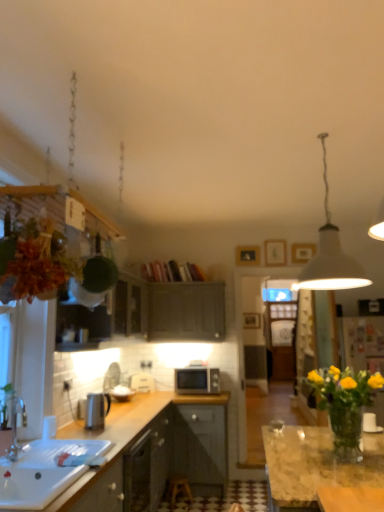
I want to click on white matte pendant lamp at upper right, so click(x=331, y=255).

This screenshot has width=384, height=512. Describe the element at coordinates (35, 261) in the screenshot. I see `leather-like brown plant hanger at upper left` at that location.

At what (x,y) coordinates should I click in order to perform the action: click on leather-like brown plant hanger at upper left. Please return your answer as a coordinate pair (x, y). This screenshot has width=384, height=512. Looking at the image, I should click on (35, 261).

Identify the location of brushed metal faucet at left. (16, 428).

Describe the element at coordinates (97, 410) in the screenshot. This screenshot has width=384, height=512. I see `metallic silver kettle at left` at that location.

The height and width of the screenshot is (512, 384). What do you see at coordinates (142, 382) in the screenshot? I see `white matte microwave at center` at bounding box center [142, 382].

In order to face white matte microwave at center, should I rotate leftwards or rightwards?

Turn left approximately 6.537 degrees to face it.

The width and height of the screenshot is (384, 512). Find the location of `green matte cabinet at upper left, the 2th cabinetry when ordered from right to left`. green matte cabinet at upper left, the 2th cabinetry when ordered from right to left is located at coordinates point(152,312).

Who is shorter, metallic silver kettle at left or wooden stool at center?

wooden stool at center.

Could you tell me if metallic silver kettle at left is facing wooden stool at center?

No, metallic silver kettle at left is not oriented towards wooden stool at center.

Is metallic silver kettle at left positioned in front of wooden stool at center?

Yes.

Looking at this image, is metallic silver kettle at left wider or thinner than wooden stool at center?

Clearly, metallic silver kettle at left has less width compared to wooden stool at center.

Is wooden stool at center facing towards white matte microwave at center?

No, wooden stool at center does not turn towards white matte microwave at center.

From a real-world perspective, is wooden stool at center above or below white matte microwave at center?

Clearly, from a real-world perspective, wooden stool at center is below white matte microwave at center.

Consider the image. Is wooden stool at center placed right next to white matte microwave at center?

wooden stool at center and white matte microwave at center are clearly separated.

Does point (175, 504) come closer to viewer compared to point (133, 375)?

Yes, it is in front of point (133, 375).

Is leather-like brown plant hanger at upper left positioned with its back to green matte cabinet at upper left, which is the second cabinetry in back-to-front order?

No, green matte cabinet at upper left, which is the second cabinetry in back-to-front order, is not at the back of leather-like brown plant hanger at upper left.

Between leather-like brown plant hanger at upper left and green matte cabinet at upper left, the 2th cabinetry when ordered from right to left, which one has less height?

leather-like brown plant hanger at upper left.

Is leather-like brown plant hanger at upper left not within green matte cabinet at upper left, which is the second cabinetry in back-to-front order?

That's correct, leather-like brown plant hanger at upper left is outside of green matte cabinet at upper left, which is the second cabinetry in back-to-front order.

From the image's perspective, which cabinetry is the 1st one below the leather-like brown plant hanger at upper left? Please provide its 2D coordinates.

[(152, 312)]

From a real-world perspective, who is located higher, metallic silver kettle at left or matte gray cabinet at center, the second cabinetry in the left-to-right sequence?

matte gray cabinet at center, the second cabinetry in the left-to-right sequence, is physically above.

Is there a large distance between metallic silver kettle at left and matte gray cabinet at center, positioned as the first cabinetry in right-to-left order?

Yes.

Could you tell me if metallic silver kettle at left is facing matte gray cabinet at center, positioned as the first cabinetry in right-to-left order?

No, metallic silver kettle at left is not facing towards matte gray cabinet at center, positioned as the first cabinetry in right-to-left order.

In the image, is metallic silver kettle at left on the left side or the right side of matte gray cabinet at center, which is the 1th cabinetry from back to front?

metallic silver kettle at left is to the left of matte gray cabinet at center, which is the 1th cabinetry from back to front.

Which of these two, leather-like brown plant hanger at upper left or white matte pendant lamp at upper right, is wider?

white matte pendant lamp at upper right.

Considering the points (22, 222) and (366, 280), which point is behind, point (22, 222) or point (366, 280)?

The point (366, 280) is farther from the camera.

Find the location of a particular element. This screenshot has height=512, width=384. houseplant that is under the white matte pendant lamp at upper right (from a real-world perspective) is located at coordinates (35, 261).

From the picture: How different are the orientations of leather-like brown plant hanger at upper left and white matte pendant lamp at upper right in degrees?

There is a 89.8-degree angle between the facing directions of leather-like brown plant hanger at upper left and white matte pendant lamp at upper right.

Image resolution: width=384 pixels, height=512 pixels. I want to click on kitchen appliance below the green matte cabinet at upper left, which ranks as the 1th cabinetry in front-to-back order (from a real-world perspective), so click(97, 410).

Does green matte cabinet at upper left, which is the second cabinetry in back-to-front order, have a smaller size compared to metallic silver kettle at left?

No.

Which object is thinner, green matte cabinet at upper left, which ranks as the first cabinetry in left-to-right order, or metallic silver kettle at left?

metallic silver kettle at left is thinner.

Relative to metallic silver kettle at left, is white matte pendant lamp at upper right in front or behind?

In the image, white matte pendant lamp at upper right appears in front of metallic silver kettle at left.

In the image, there is a metallic silver kettle at left. Identify the location of light fixture above it (from the image's perspective). Image resolution: width=384 pixels, height=512 pixels. (331, 255).

Considering the positions of point (306, 270) and point (108, 412), is point (306, 270) closer or farther from the camera than point (108, 412)?

Point (306, 270) appears to be closer to the viewer than point (108, 412).

In order to click on kitchen appliance that is above the wooden stool at center (from a real-world perspective) in this screenshot , I will do `click(97, 410)`.

Identify the location of appliance above the wooden stool at center (from the image's perspective). Image resolution: width=384 pixels, height=512 pixels. pyautogui.click(x=142, y=382).

Which object lies nearer to the anchor point matte black microwave at center, metallic silver kettle at left or white matte pendant lamp at upper right?

Among the two, metallic silver kettle at left is located nearer to matte black microwave at center.

Based on their spatial positions, is translucent glass vase at center right or leather-like brown plant hanger at upper left closer to matte gray cabinet at center, which is the 1th cabinetry from back to front?

Based on the image, translucent glass vase at center right appears to be nearer to matte gray cabinet at center, which is the 1th cabinetry from back to front.

Based on their spatial positions, is matte gray cabinet at center, the second cabinetry in the left-to-right sequence, or white matte pendant lamp at upper right closer to white glossy sink at lower left?

white matte pendant lamp at upper right lies closer to white glossy sink at lower left than the other object.

From the image, which object appears to be farther from matte black microwave at center, green matte cabinet at upper left, which ranks as the 1th cabinetry in front-to-back order, or leather-like brown plant hanger at upper left?

The object further to matte black microwave at center is leather-like brown plant hanger at upper left.

Consider the image. When comparing their distances from white matte microwave at center, does matte gray cabinet at center, marked as the 2th cabinetry in a front-to-back arrangement, or wooden stool at center seem closer?

matte gray cabinet at center, marked as the 2th cabinetry in a front-to-back arrangement, lies closer to white matte microwave at center than the other object.

Based on their spatial positions, is white matte microwave at center or matte gray cabinet at center, marked as the 2th cabinetry in a front-to-back arrangement, closer to leather-like brown plant hanger at upper left?

matte gray cabinet at center, marked as the 2th cabinetry in a front-to-back arrangement.

Considering their positions, is leather-like brown plant hanger at upper left positioned further to translucent glass vase at center right than metallic silver kettle at left?

leather-like brown plant hanger at upper left is further to translucent glass vase at center right.

Looking at the image, which one is located further to wooden stool at center, leather-like brown plant hanger at upper left or metallic silver kettle at left?

Based on the image, leather-like brown plant hanger at upper left appears to be further to wooden stool at center.

Locate an element on the screen. The width and height of the screenshot is (384, 512). appliance between matte gray cabinet at center, marked as the 2th cabinetry in a front-to-back arrangement, and wooden stool at center vertically is located at coordinates (142, 382).

At what (x,y) coordinates should I click in order to perform the action: click on kitchen appliance between green matte cabinet at upper left, which ranks as the first cabinetry in left-to-right order, and translucent glass vase at center right from left to right. Please return your answer as a coordinate pair (x, y). The width and height of the screenshot is (384, 512). Looking at the image, I should click on (97, 410).

The image size is (384, 512). Find the location of `tap between translucent glass vase at center right and white matte microwave at center from front to back`. tap between translucent glass vase at center right and white matte microwave at center from front to back is located at coordinates (16, 428).

This screenshot has width=384, height=512. In order to click on kitchen appliance between white matte pendant lamp at upper right and wooden stool at center vertically in this screenshot , I will do `click(97, 410)`.